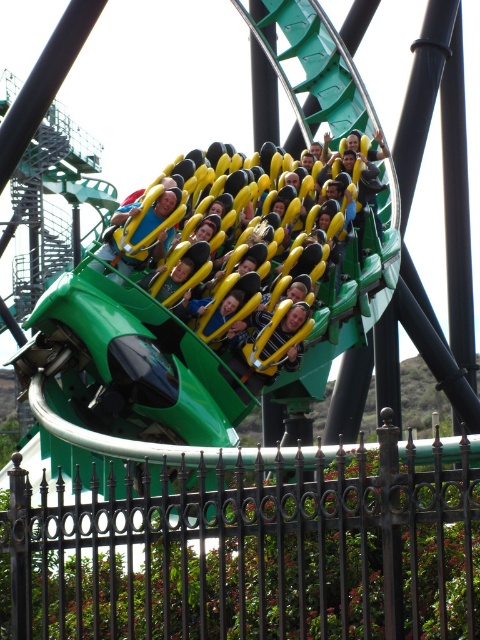
Who is lower down, green matte roller coaster at center or yellow padded seat at center?

green matte roller coaster at center is below.

Can you confirm if green matte roller coaster at center is positioned below yellow padded seat at center?

Yes, green matte roller coaster at center is below yellow padded seat at center.

Find the location of a particular element. The width and height of the screenshot is (480, 640). green matte roller coaster at center is located at coordinates (202, 337).